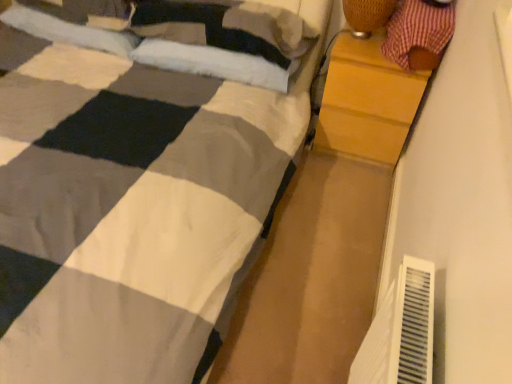
Find the location of a particular element. free area below woven bamboo lampshade at upper right (from a real-world perspective) is located at coordinates (359, 36).